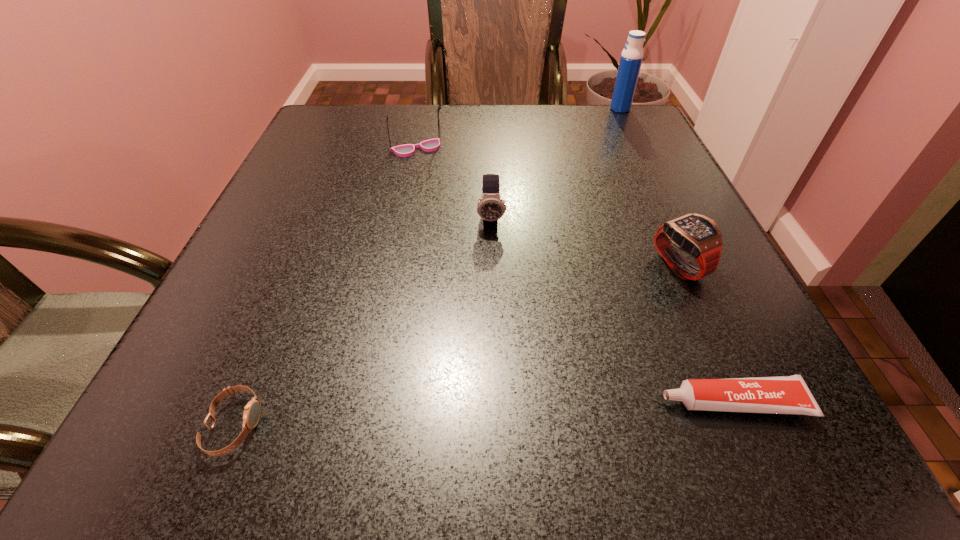
Image resolution: width=960 pixels, height=540 pixels. Identify the location of water bottle. (631, 58).

The height and width of the screenshot is (540, 960). I want to click on the farthest object, so click(631, 58).

Find the location of a particular element. This screenshot has height=540, width=960. spectacles is located at coordinates (430, 145).

Where is `the second farthest object`? This screenshot has height=540, width=960. the second farthest object is located at coordinates (430, 145).

Identify the location of the second watch from left to right. Image resolution: width=960 pixels, height=540 pixels. (491, 207).

Find the location of a particular element. the farthest watch is located at coordinates (491, 207).

This screenshot has width=960, height=540. Identify the location of the third nearest object. (697, 235).

This screenshot has height=540, width=960. Identify the location of the rightmost watch. (697, 235).

Where is `toothpaste`? This screenshot has width=960, height=540. toothpaste is located at coordinates (788, 394).

Find the location of a particular element. The image size is (960, 540). the nearest watch is located at coordinates (252, 411).